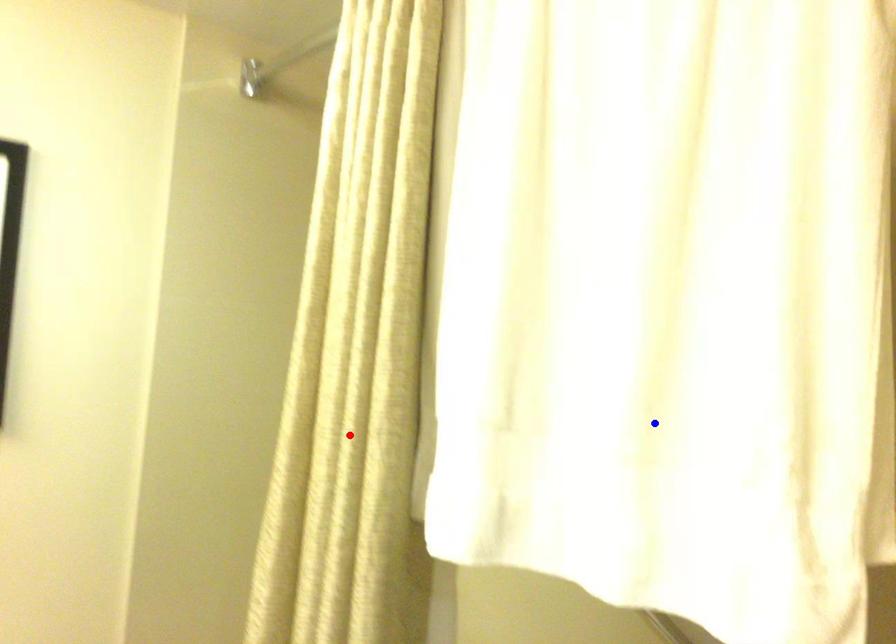
Question: In the image, two points are highlighted. Which point is nearer to the camera? Reply with the corresponding letter.

Choices:
 (A) blue point
 (B) red point

Answer: (A)